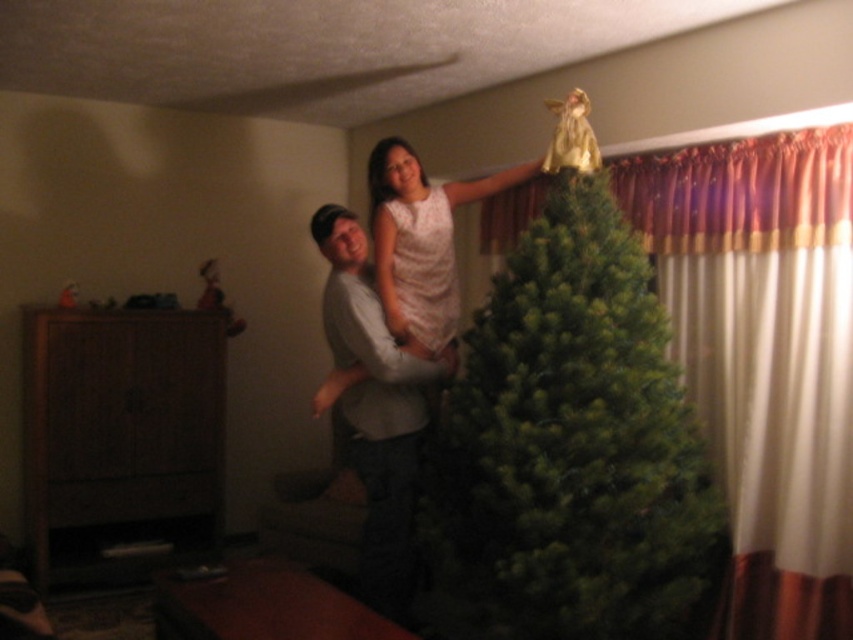
You are a delivery person who needs to place a rectangular box that measures 20 inches in length between the green matte christmas tree at center and the gray cotton shirt at center. Can the box fit in the space between them without overlapping?

The distance between the green matte christmas tree at center and the gray cotton shirt at center is 19.73 inches. Since the box is 20 inches long, it cannot fit in the space between them without overlapping.

You are standing in the room and want to place a new decoration on the gray cotton shirt at center. Where exactly should you place it in terms of coordinates?

The gray cotton shirt at center is located at point (374,410), so you should place the decoration at those coordinates.